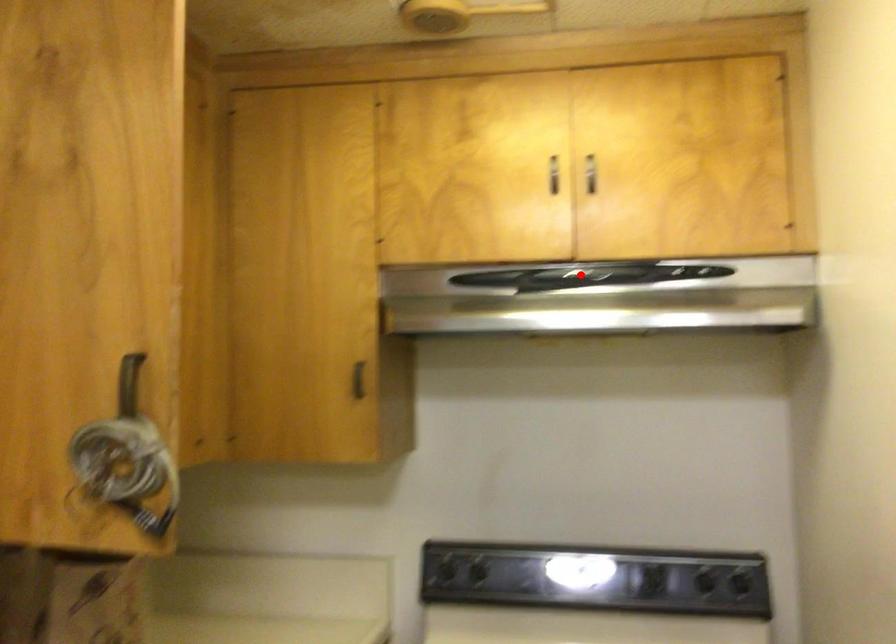
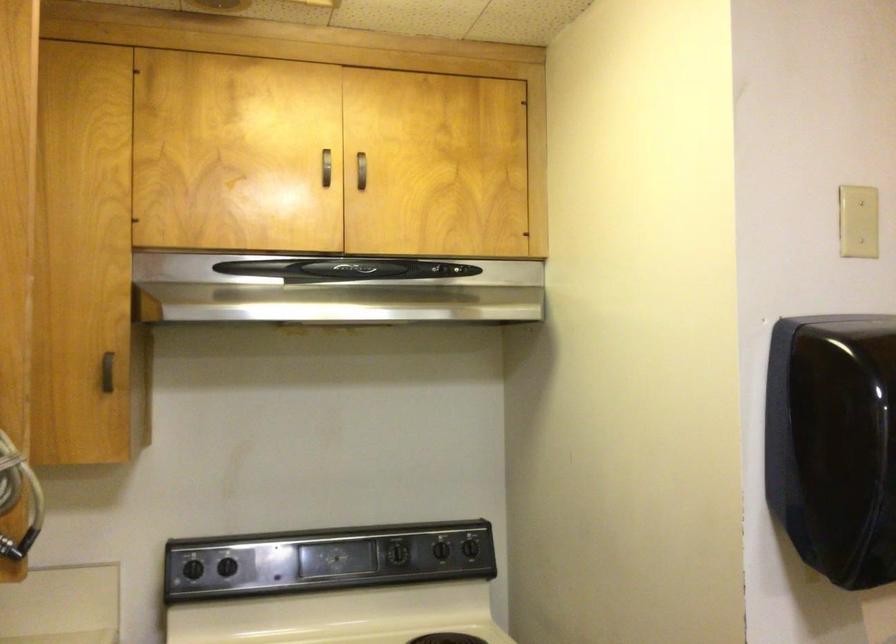
In the second image, find the point that corresponds to the highlighted location in the first image.

(345, 269)